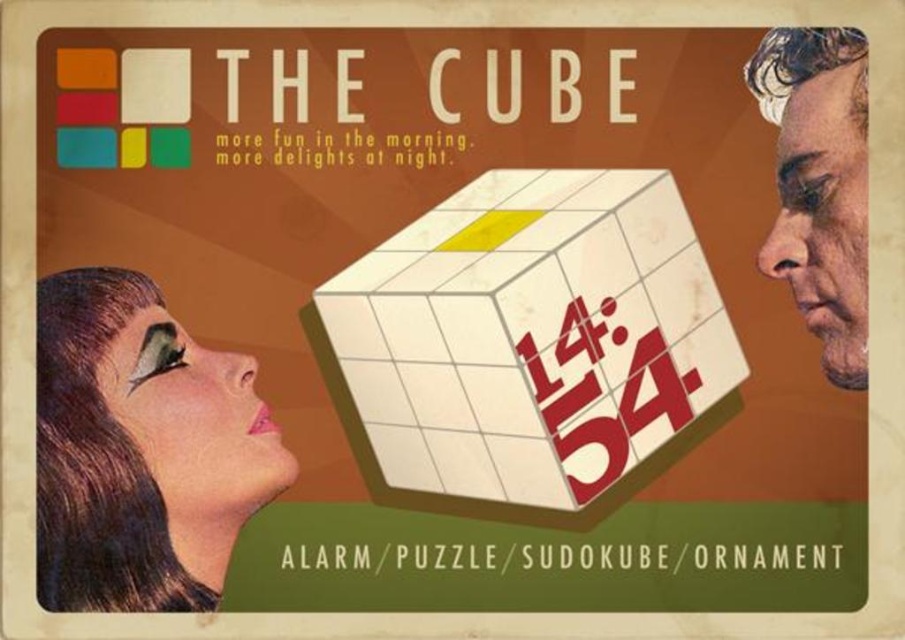
Question: Which of the following is the farthest from the observer?

Choices:
 (A) (117, 529)
 (B) (834, 348)
 (C) (541, 230)

Answer: (B)

Question: Observing the image, what is the correct spatial positioning of matte black face at lower left in reference to smooth skin face at right?

Choices:
 (A) below
 (B) above

Answer: (A)

Question: Estimate the real-world distances between objects in this image. Which object is closer to the white matte cube at center?

Choices:
 (A) matte black face at lower left
 (B) smooth skin face at right

Answer: (B)

Question: Can you confirm if white matte cube at center is wider than smooth skin face at right?

Choices:
 (A) yes
 (B) no

Answer: (A)

Question: Can you confirm if white matte cube at center is bigger than smooth skin face at right?

Choices:
 (A) yes
 (B) no

Answer: (A)

Question: Which object appears closest to the camera in this image?

Choices:
 (A) white matte cube at center
 (B) smooth skin face at right
 (C) matte black face at lower left

Answer: (A)